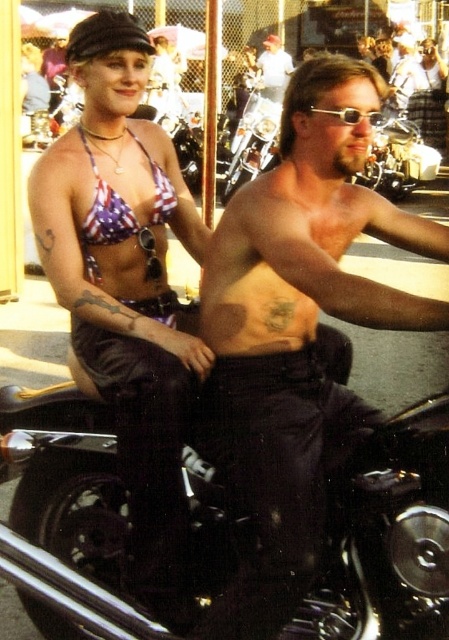
You are a photographer at a beach event and need to capture a photo of the american flag bikini top at left and the smooth white shirt at center. Based on their sizes, which object should you focus on first to ensure they both fit in the frame?

The american flag bikini top at left is thinner than the smooth white shirt at center, so you should focus on the smooth white shirt at center first since it is wider and requires more space in the frame to ensure both fit properly.

You are a photographer standing at the scene and want to capture a photo of the american flag bikini top at left and the smooth white shirt at center. Your camera has a maximum focus range of 10 meters. Can you get both objects in focus without moving your position?

The distance between the american flag bikini top at left and smooth white shirt at center is 10.90 meters, which exceeds the camera maximum focus range of 10 meters. Therefore, you cannot get both objects in focus without moving your position.